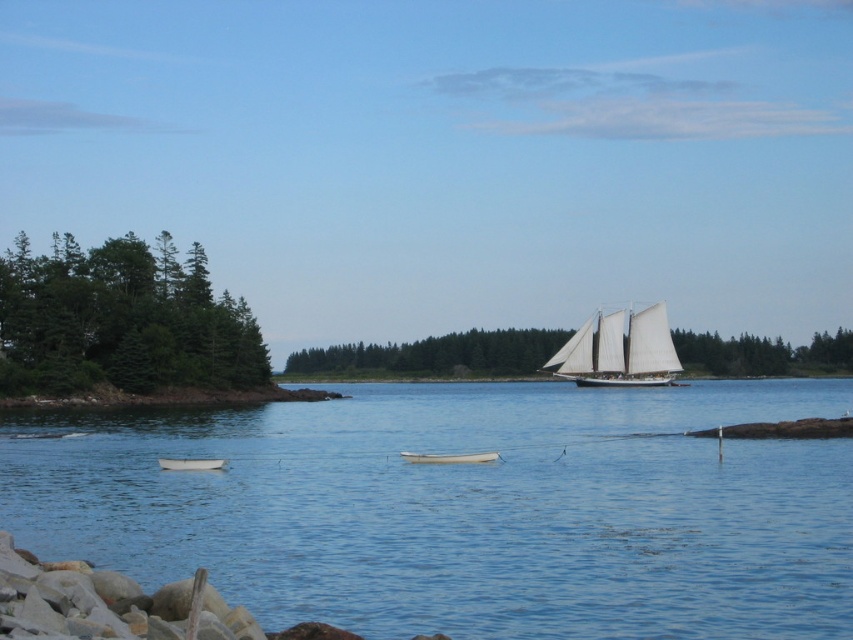
You are standing on the rocky shoreline and see the white matte rowboat at lower left and the clear blue water at center. Which object is closer to your position?

The white matte rowboat at lower left is closer to your position because it is to the left of the clear blue water at center, which is further away to the right.

You are standing on the rocky shoreline and want to reach the clear blue water at center. Which direction should you walk to get there?

You should walk towards the center of the image to reach the clear blue water at center, as it is located at point coordinates of (465,508).

You are standing on the rocky shoreline and see the clear blue water at center and the white matte boat at center. Which object is closer to you?

The white matte boat at center is closer to you because it is positioned above the clear blue water at center, which is beneath it.